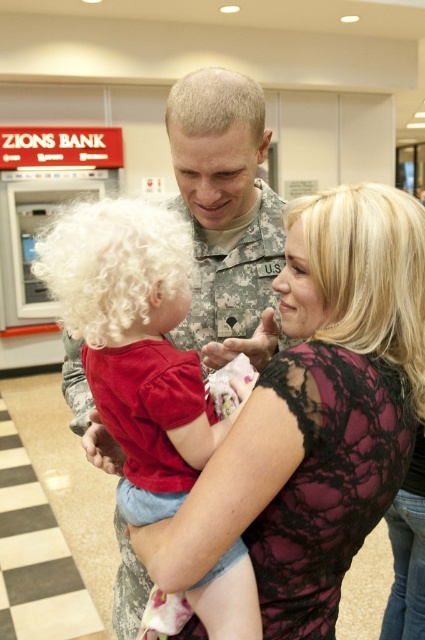
Can you confirm if soft white hair at center is positioned to the left of blonde lace wig at upper right?

Correct, you'll find soft white hair at center to the left of blonde lace wig at upper right.

Can you confirm if soft white hair at center is positioned below blonde lace wig at upper right?

Yes.

Locate an element on the screen. The height and width of the screenshot is (640, 425). soft white hair at center is located at coordinates 135,342.

Where is `soft white hair at center`? This screenshot has height=640, width=425. soft white hair at center is located at coordinates (135, 342).

Describe the element at coordinates (135, 342) in the screenshot. The height and width of the screenshot is (640, 425). I see `soft white hair at center` at that location.

Where is `soft white hair at center`? This screenshot has width=425, height=640. soft white hair at center is located at coordinates (135, 342).

At what (x,y) coordinates should I click in order to perform the action: click on soft white hair at center. Please return your answer as a coordinate pair (x, y). Looking at the image, I should click on (135, 342).

I want to click on soft white hair at center, so click(135, 342).

Between blonde lace wig at upper right and curly white wig at left, which one is positioned higher?

Positioned higher is curly white wig at left.

The image size is (425, 640). I want to click on blonde lace wig at upper right, so click(370, 273).

At what (x,y) coordinates should I click in order to perform the action: click on blonde lace wig at upper right. Please return your answer as a coordinate pair (x, y). Image resolution: width=425 pixels, height=640 pixels. Looking at the image, I should click on coord(370,273).